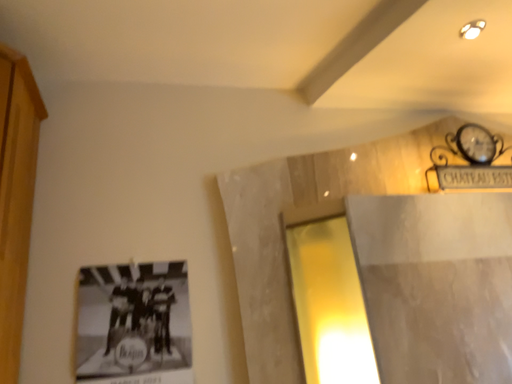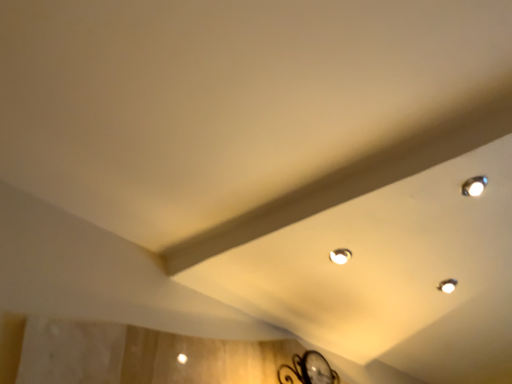
Question: Which way did the camera rotate in the video?

Choices:
 (A) rotated left
 (B) rotated right

Answer: (B)